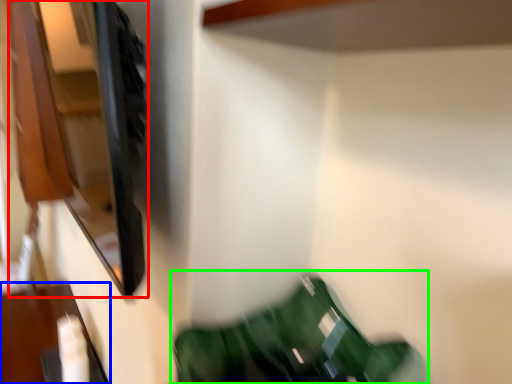
Question: Based on their relative distances, which object is nearer to cabinet (highlighted by a red box)? Choose from furniture (highlighted by a blue box) and bean bag chair (highlighted by a green box).

Choices:
 (A) furniture
 (B) bean bag chair

Answer: (A)